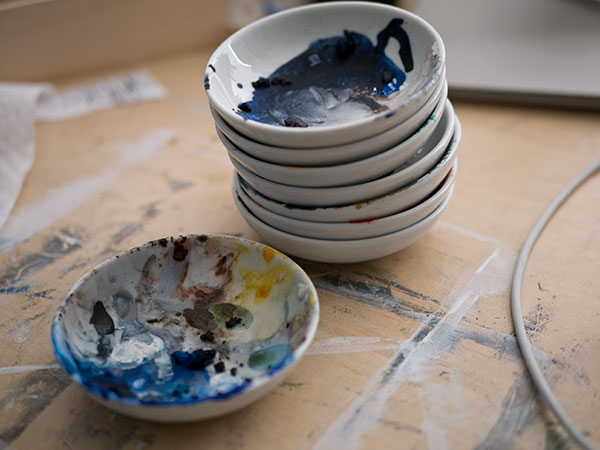
At what (x,y) coordinates should I click in order to perform the action: click on vertical panel in background. Please return your answer as a coordinate pair (x, y). Looking at the image, I should click on (143, 31).